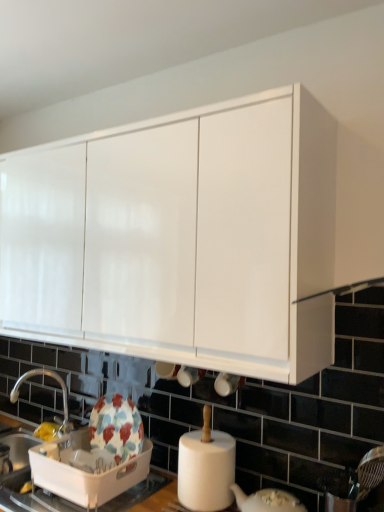
Question: Is floral ceramic dish drainer at lower left oriented away from silver metallic tap at lower left?

Choices:
 (A) yes
 (B) no

Answer: (B)

Question: Is floral ceramic dish drainer at lower left smaller than silver metallic tap at lower left?

Choices:
 (A) no
 (B) yes

Answer: (A)

Question: From a real-world perspective, is floral ceramic dish drainer at lower left on silver metallic tap at lower left?

Choices:
 (A) no
 (B) yes

Answer: (A)

Question: Can silver metallic tap at lower left be found inside floral ceramic dish drainer at lower left?

Choices:
 (A) no
 (B) yes

Answer: (A)

Question: Is floral ceramic dish drainer at lower left at the right side of silver metallic tap at lower left?

Choices:
 (A) yes
 (B) no

Answer: (A)

Question: From a real-world perspective, is floral ceramic dish drainer at lower left under silver metallic tap at lower left?

Choices:
 (A) no
 (B) yes

Answer: (B)

Question: Is the position of white glossy cabinet at upper center less distant than that of floral ceramic dish drainer at lower left?

Choices:
 (A) no
 (B) yes

Answer: (B)

Question: Considering the relative sizes of white glossy cabinet at upper center and floral ceramic dish drainer at lower left in the image provided, is white glossy cabinet at upper center smaller than floral ceramic dish drainer at lower left?

Choices:
 (A) no
 (B) yes

Answer: (A)

Question: Is white glossy cabinet at upper center far from floral ceramic dish drainer at lower left?

Choices:
 (A) yes
 (B) no

Answer: (B)

Question: Does white glossy cabinet at upper center appear on the left side of floral ceramic dish drainer at lower left?

Choices:
 (A) no
 (B) yes

Answer: (B)

Question: From the image's perspective, would you say white glossy cabinet at upper center is positioned over floral ceramic dish drainer at lower left?

Choices:
 (A) no
 (B) yes

Answer: (B)

Question: Is white glossy cabinet at upper center bigger than floral ceramic dish drainer at lower left?

Choices:
 (A) no
 (B) yes

Answer: (B)

Question: From the image's perspective, is white glossy cabinet at upper center below silver metallic tap at lower left?

Choices:
 (A) yes
 (B) no

Answer: (B)